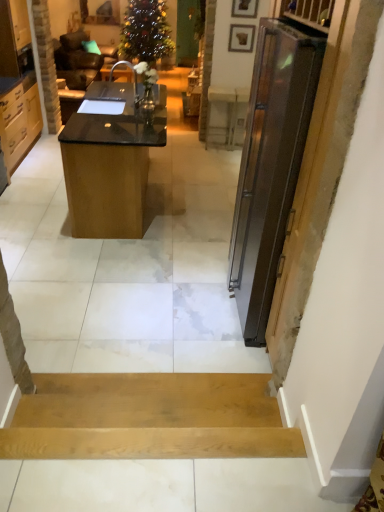
Question: Does wooden picture frame at upper center, the 1th picture frame from the back, have a smaller size compared to black glossy desk at center?

Choices:
 (A) yes
 (B) no

Answer: (A)

Question: Is wooden picture frame at upper center, which is counted as the second picture frame, starting from the front, surrounding black glossy desk at center?

Choices:
 (A) no
 (B) yes

Answer: (A)

Question: Is wooden picture frame at upper center, which is counted as the second picture frame, starting from the front, oriented towards black glossy desk at center?

Choices:
 (A) yes
 (B) no

Answer: (B)

Question: Considering the relative sizes of wooden picture frame at upper center, the 1th picture frame from the back, and black glossy desk at center in the image provided, is wooden picture frame at upper center, the 1th picture frame from the back, shorter than black glossy desk at center?

Choices:
 (A) yes
 (B) no

Answer: (A)

Question: Is wooden picture frame at upper center, which is counted as the second picture frame, starting from the front, looking in the opposite direction of black glossy desk at center?

Choices:
 (A) no
 (B) yes

Answer: (A)

Question: Looking at their shapes, would you say wooden picture frame at upper center, which ranks as the second picture frame in top-to-bottom order, is wider or thinner than black glossy desk at center?

Choices:
 (A) wide
 (B) thin

Answer: (B)

Question: From their relative heights in the image, would you say wooden picture frame at upper center, which ranks as the second picture frame in top-to-bottom order, is taller or shorter than black glossy desk at center?

Choices:
 (A) short
 (B) tall

Answer: (A)

Question: Would you say wooden picture frame at upper center, which ranks as the second picture frame in top-to-bottom order, is inside or outside black glossy desk at center?

Choices:
 (A) outside
 (B) inside

Answer: (A)

Question: From a real-world perspective, is wooden picture frame at upper center, the 1th picture frame from the back, above or below black glossy desk at center?

Choices:
 (A) above
 (B) below

Answer: (A)

Question: Is wooden picture frame at upper center, the 2th picture frame viewed from the back, in front of or behind light brown wood drawers at left, the first cabinetry in the top-to-bottom sequence, in the image?

Choices:
 (A) behind
 (B) front

Answer: (A)

Question: Is wooden picture frame at upper center, which is the first picture frame in top-to-bottom order, wider or thinner than light brown wood drawers at left, the first cabinetry in the top-to-bottom sequence?

Choices:
 (A) wide
 (B) thin

Answer: (B)

Question: From the image's perspective, is wooden picture frame at upper center, the 1th picture frame viewed from the front, located above or below light brown wood drawers at left, the first cabinetry in the top-to-bottom sequence?

Choices:
 (A) below
 (B) above

Answer: (B)

Question: Visually, is wooden picture frame at upper center, the 2th picture frame viewed from the back, positioned to the left or to the right of light brown wood drawers at left, the 2th cabinetry ordered from the bottom?

Choices:
 (A) right
 (B) left

Answer: (A)

Question: From the image's perspective, is light brown wood drawers at left, the first cabinetry in the top-to-bottom sequence, positioned above or below wooden picture frame at upper center, the 1th picture frame ordered from the bottom?

Choices:
 (A) below
 (B) above

Answer: (A)

Question: Is light brown wood drawers at left, the first cabinetry in the top-to-bottom sequence, taller or shorter than wooden picture frame at upper center, which ranks as the second picture frame in top-to-bottom order?

Choices:
 (A) short
 (B) tall

Answer: (B)